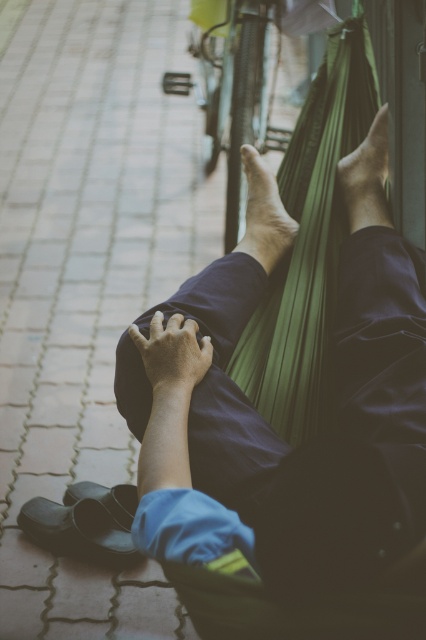
Identify the location of black leather sandal at lower left. The height and width of the screenshot is (640, 426). (85, 522).

Which is behind, point (135, 557) or point (258, 160)?

Positioned behind is point (135, 557).

Between point (108, 547) and point (276, 208), which one is positioned in front?

Point (276, 208) is more forward.

Where is `black leather sandal at lower left`? This screenshot has width=426, height=640. black leather sandal at lower left is located at coordinates (85, 522).

Which is more to the left, smooth skin foot at center or smooth skin foot at upper center?

smooth skin foot at center is more to the left.

Image resolution: width=426 pixels, height=640 pixels. What do you see at coordinates (264, 212) in the screenshot?
I see `smooth skin foot at center` at bounding box center [264, 212].

Which is in front, point (247, 237) or point (362, 179)?

Point (362, 179) is in front.

The height and width of the screenshot is (640, 426). Find the location of `smooth skin foot at center`. smooth skin foot at center is located at coordinates (264, 212).

Which is in front, point (233, 442) or point (354, 212)?

Point (233, 442)

Is the position of green fabric hammock at upper center more distant than that of smooth skin foot at upper center?

No.

Which is in front, point (368, 294) or point (385, 224)?

Point (368, 294) is more forward.

At what (x,y) coordinates should I click in order to perform the action: click on green fabric hammock at upper center. Please return your answer as a coordinate pair (x, y). This screenshot has width=426, height=640. Looking at the image, I should click on (333, 396).